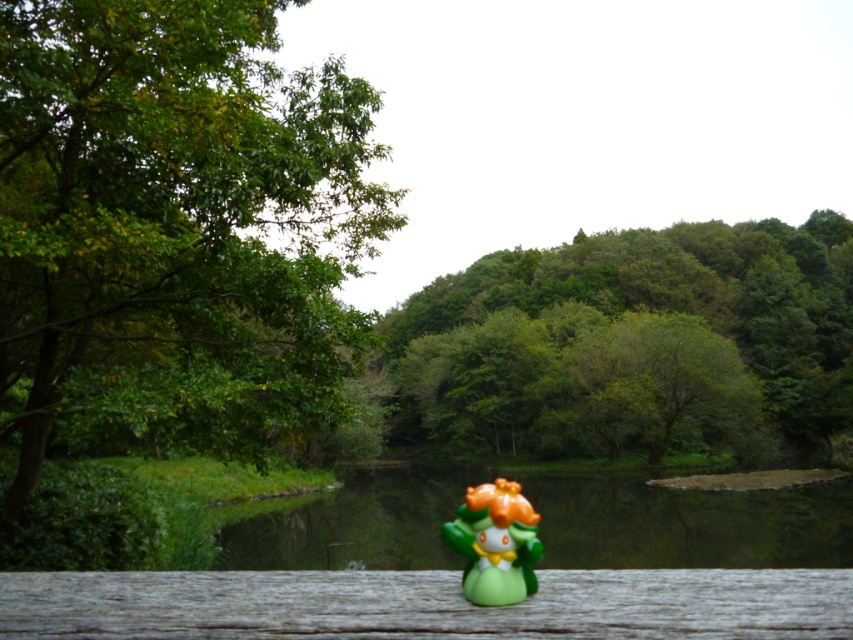
Can you confirm if green leafy trees at center is smaller than green matte tree at center?

Incorrect, green leafy trees at center is not smaller in size than green matte tree at center.

Measure the distance between green leafy trees at center and green matte tree at center.

They are 11.74 meters apart.

Is point (722, 225) positioned after point (585, 372)?

That is True.

Find the location of a particular element. The image size is (853, 640). green leafy trees at center is located at coordinates (636, 342).

Measure the distance between green leafy tree at left and camera.

green leafy tree at left and camera are 21.39 feet apart.

Identify the location of green leafy tree at left. Image resolution: width=853 pixels, height=640 pixels. (173, 221).

Is green leafy trees at center positioned at the back of green matte figurine at center?

Yes.

Who is more forward, (850, 401) or (527, 570)?

Positioned in front is point (527, 570).

The width and height of the screenshot is (853, 640). I want to click on green leafy trees at center, so click(x=636, y=342).